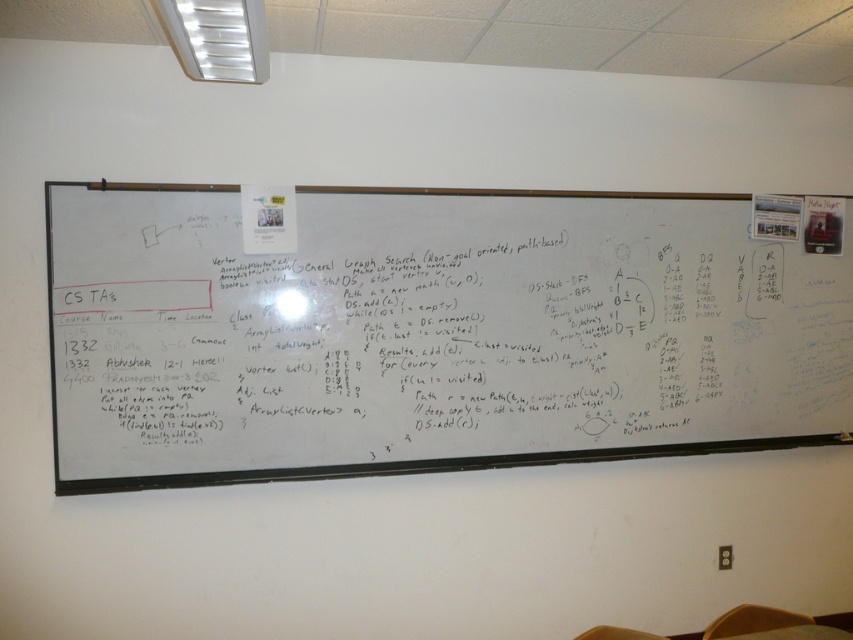
Between point (106, 326) and point (727, 634), which one is positioned behind?

Point (106, 326)

Is whiteboard at center shorter than yellow fabric chair at lower right?

No, whiteboard at center is not shorter than yellow fabric chair at lower right.

Is point (445, 330) in front of point (743, 616)?

No, it is behind (743, 616).

Where is `whiteboard at center`? whiteboard at center is located at coordinates (434, 330).

Can you confirm if yellow fabric chair at lower right is bigger than brown wood chair at lower center?

Indeed, yellow fabric chair at lower right has a larger size compared to brown wood chair at lower center.

Can you confirm if yellow fabric chair at lower right is taller than brown wood chair at lower center?

Indeed, yellow fabric chair at lower right has a greater height compared to brown wood chair at lower center.

Does point (776, 611) come in front of point (663, 636)?

Yes, point (776, 611) is closer to viewer.

Where is `yellow fabric chair at lower right`? This screenshot has height=640, width=853. yellow fabric chair at lower right is located at coordinates (753, 620).

Is point (236, 292) positioned before point (664, 637)?

No.

Find the location of a particular element. The width and height of the screenshot is (853, 640). whiteboard at center is located at coordinates (434, 330).

This screenshot has height=640, width=853. In order to click on whiteboard at center in this screenshot , I will do `click(434, 330)`.